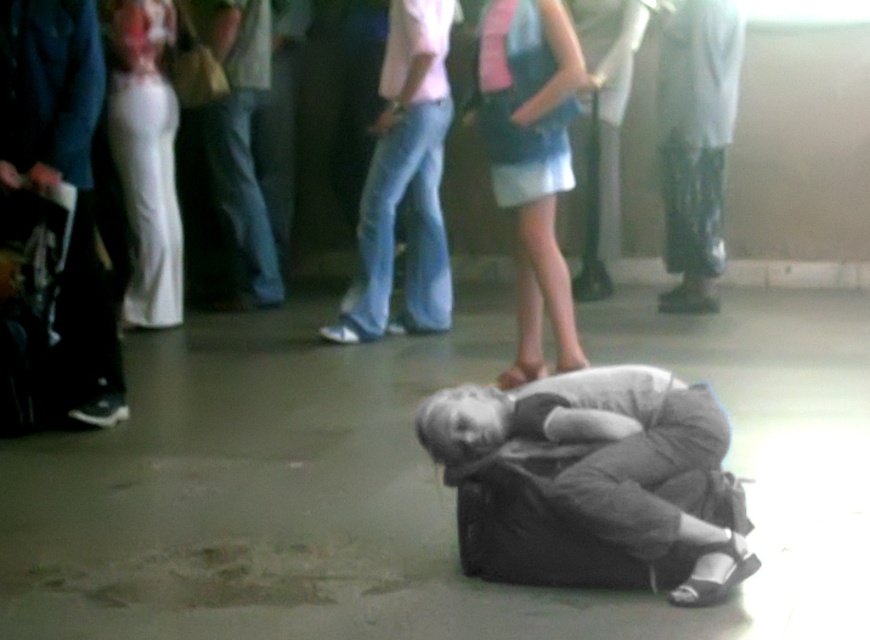
From the picture: Is dark blue jeans at left bigger than blue denim skirt at center?

Incorrect, dark blue jeans at left is not larger than blue denim skirt at center.

Measure the distance between point (28, 80) and camera.

16.70 feet

Between point (12, 180) and point (507, 92), which one is positioned in front?

Positioned in front is point (12, 180).

Locate an element on the screen. The width and height of the screenshot is (870, 640). dark blue jeans at left is located at coordinates (64, 179).

Is blue denim skirt at center taller than denim jeans at center?

Incorrect, blue denim skirt at center's height is not larger of denim jeans at center's.

Which is below, blue denim skirt at center or denim jeans at center?

blue denim skirt at center is below.

I want to click on blue denim skirt at center, so click(531, 177).

How much distance is there between dark blue jeans at left and denim jeans at center?

dark blue jeans at left and denim jeans at center are 6.80 feet apart.

From the picture: Can you confirm if dark blue jeans at left is positioned below denim jeans at center?

Indeed, dark blue jeans at left is positioned under denim jeans at center.

Locate an element on the screen. dark blue jeans at left is located at coordinates (64, 179).